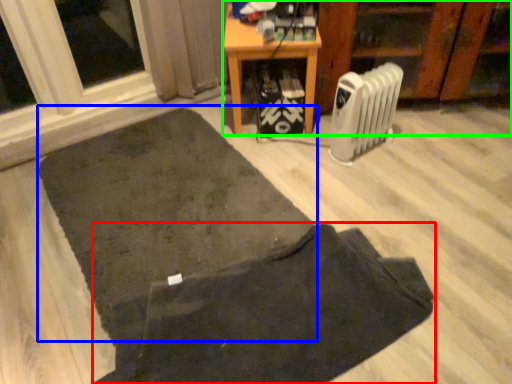
Question: Which object is positioned closest to doormat (highlighted by a red box)? Select from mat (highlighted by a blue box) and furniture (highlighted by a green box).

Choices:
 (A) mat
 (B) furniture

Answer: (A)